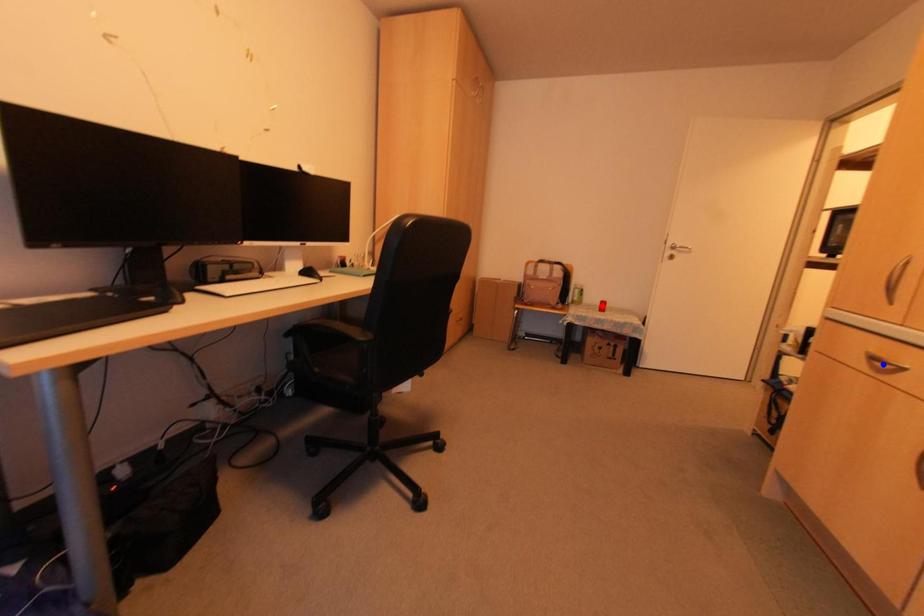
Question: Which of the two points in the image is closer to the camera?

Choices:
 (A) Blue point is closer.
 (B) Red point is closer.

Answer: (A)